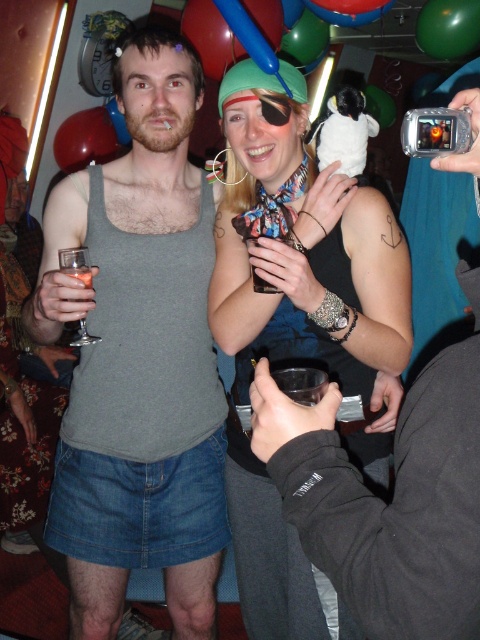
Consider the image. You are a photographer at the party and want to take a picture of the person wearing the black sleeveless top and dark pants. You notice a point at coordinates (303, 248) in the image. Based on the scene description, can you determine if this point is located on the person wearing the black sleeveless top?

The point (303, 248) is on matte black tank top at center, so yes, the point is located on the person wearing the matte black tank top, which matches the description of the woman in the black sleeveless top and dark pants.

You are at a party and want to grab a drink. You see the red rubber balloon at upper left and the clear glass wine glass at left. Which one is higher up?

The red rubber balloon at upper left is above the clear glass wine glass at left, so the red rubber balloon at upper left is higher up.